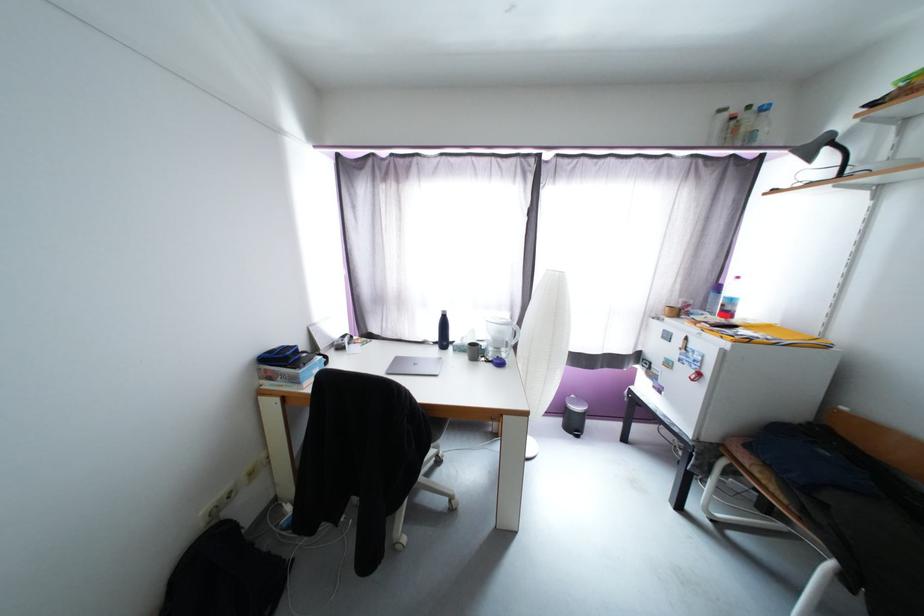
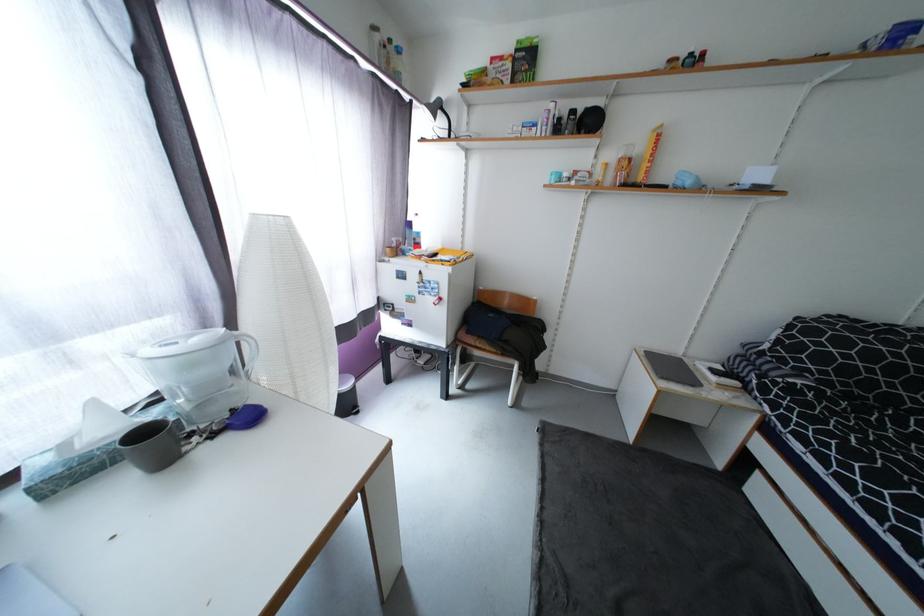
Find the pixel in the second image that matches (x=777, y=488) in the first image.

(493, 349)